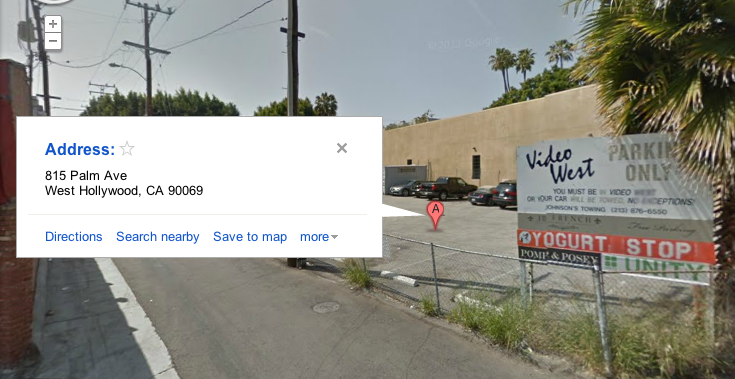
Locate an element on the screen. red brick wall is located at coordinates (20, 304).